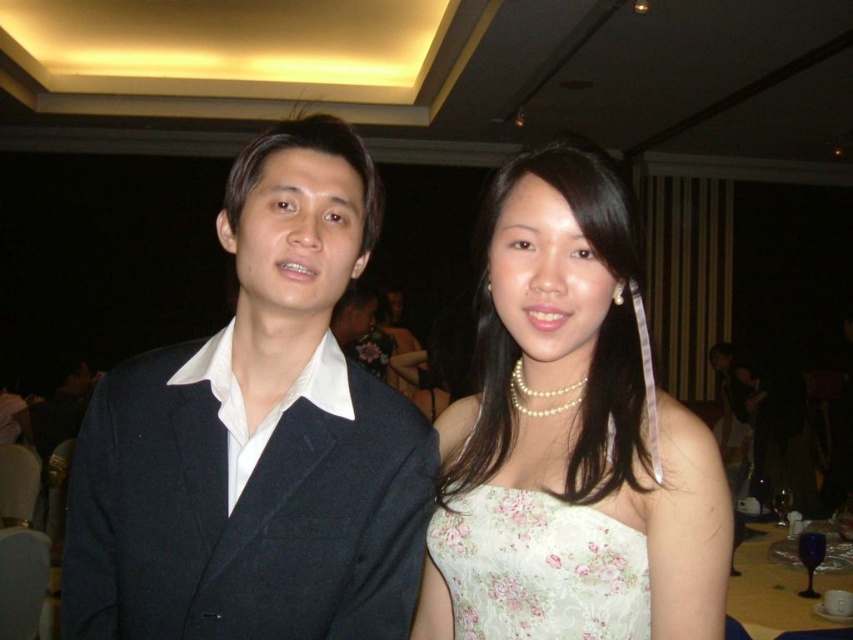
You are a photographer at a formal event. You need to adjust the lighting to ensure both the matte black suit at center and the floral satin dress at center are well lit. Which object might require more light to ensure it appears properly illuminated in the photo?

The matte black suit at center is located above the floral satin dress at center. Since black absorbs more light, the matte black suit at center might require additional lighting to ensure it is properly illuminated compared to the floral satin dress at center.

You are a photographer at the event and need to adjust the lighting to ensure both the matte black suit at center and the white floral dress at center are well illuminated. Since the black suit absorbs more light and the white dress reflects it, which object requires more light to appear properly exposed in the photo?

The matte black suit at center is in front of the white floral dress at center, so the black suit will need more light to ensure it doesn not appear too dark in the photo compared to the white dress which reflects light better.